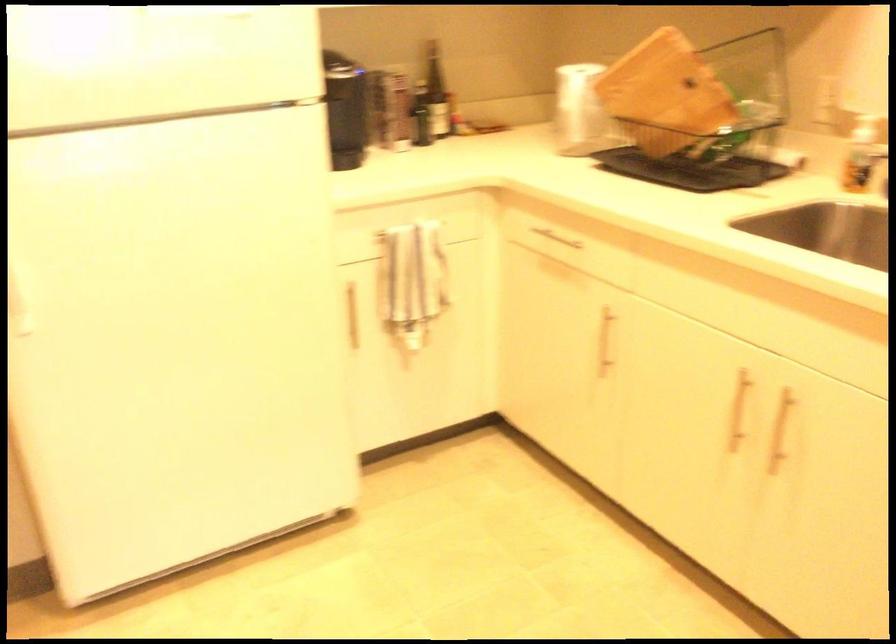
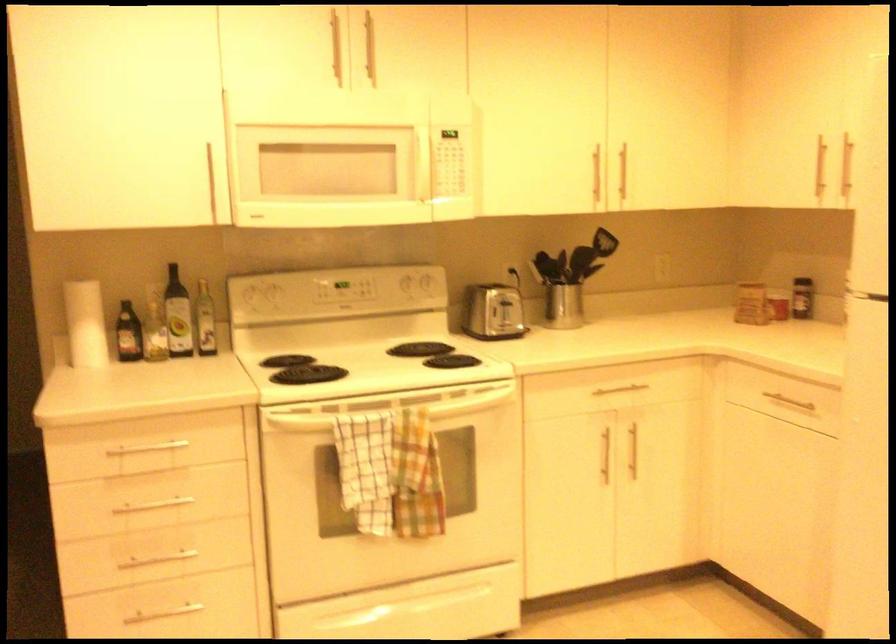
Question: How did the camera likely rotate?

Choices:
 (A) Left
 (B) Right
 (C) Up
 (D) Down

Answer: (A)